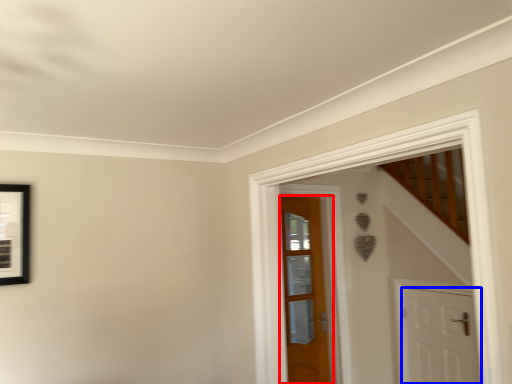
Question: Which point is closer to the camera, door (highlighted by a red box) or door (highlighted by a blue box)?

Choices:
 (A) door
 (B) door

Answer: (B)